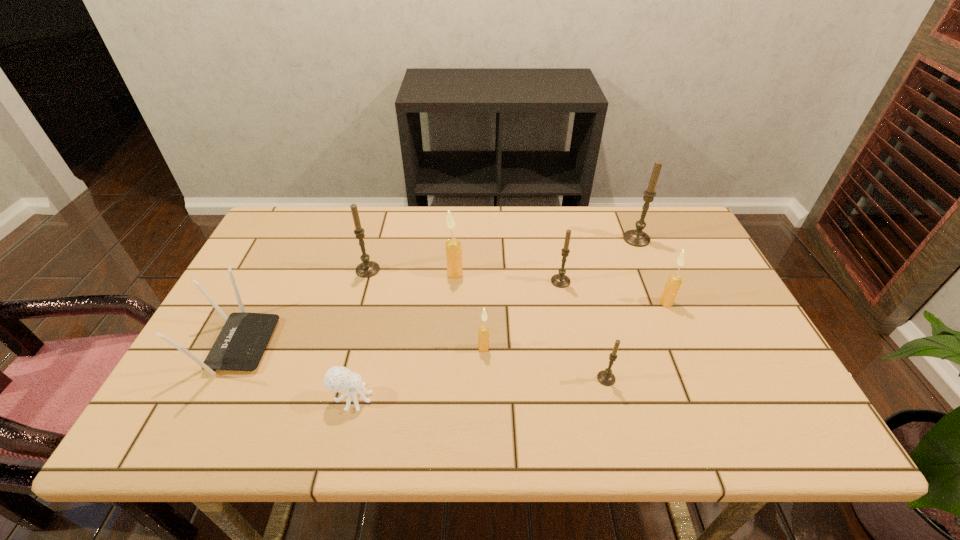
You are a GUI agent. You are given a task and a screenshot of the screen. Output one action in this format:
    pyautogui.click(x=<x>, y=<y>)
    Task: Click on the free spot at the far edge of the desktop
    This screenshot has height=540, width=960.
    Given the screenshot: What is the action you would take?
    pyautogui.click(x=441, y=220)

Find the location of a particular element. vacant space at the near edge is located at coordinates (272, 436).

You are a GUI agent. You are given a task and a screenshot of the screen. Output one action in this format:
    pyautogui.click(x=<x>, y=<y>)
    Task: Click on the free region at the left edge of the desktop
    This screenshot has width=960, height=540.
    Given the screenshot: What is the action you would take?
    pyautogui.click(x=228, y=302)

This screenshot has width=960, height=540. In the image, there is a desktop. Identify the location of vacant region at the right edge. (704, 291).

The image size is (960, 540). Find the location of `free spot between the rightmost cream candle and the octopus`. free spot between the rightmost cream candle and the octopus is located at coordinates (509, 350).

You are a GUI agent. You are given a task and a screenshot of the screen. Output one action in this format:
    pyautogui.click(x=<x>, y=<y>)
    Task: Click on the vacant space that's between the second cream candle from left to right and the leftmost object
    The width and height of the screenshot is (960, 540).
    Given the screenshot: What is the action you would take?
    pyautogui.click(x=360, y=346)

At what (x,y) coordinates should I click in order to perform the action: click on vacant space in between the second cream candle from right to left and the fifth nearest object. Please return your answer as a coordinate pair (x, y). The image size is (960, 540). Looking at the image, I should click on (575, 325).

The width and height of the screenshot is (960, 540). Find the location of `empty space between the farthest cream candle and the second cream candle from right to left`. empty space between the farthest cream candle and the second cream candle from right to left is located at coordinates (469, 310).

The height and width of the screenshot is (540, 960). Find the location of `empty location between the biggest cream candle and the white octopus`. empty location between the biggest cream candle and the white octopus is located at coordinates [x=403, y=336].

I want to click on vacant area that lies between the shortest object and the farthest gray candle, so click(x=494, y=319).